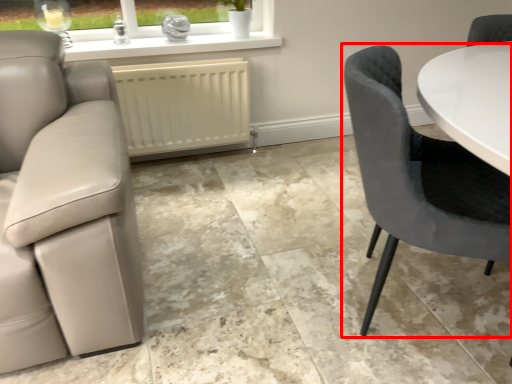
Question: In this image, where is chair (annotated by the red box) located relative to radiator?

Choices:
 (A) left
 (B) right

Answer: (B)